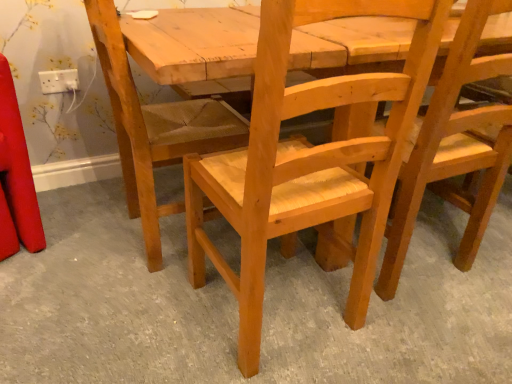
You are a GUI agent. You are given a task and a screenshot of the screen. Output one action in this format:
    pyautogui.click(x=<x>, y=<y>)
    Task: Click on the vacant space underneath natural wood chair at center, the second chair when ordered from left to right (from a real-world perspective)
    
    Given the screenshot: What is the action you would take?
    pyautogui.click(x=286, y=309)